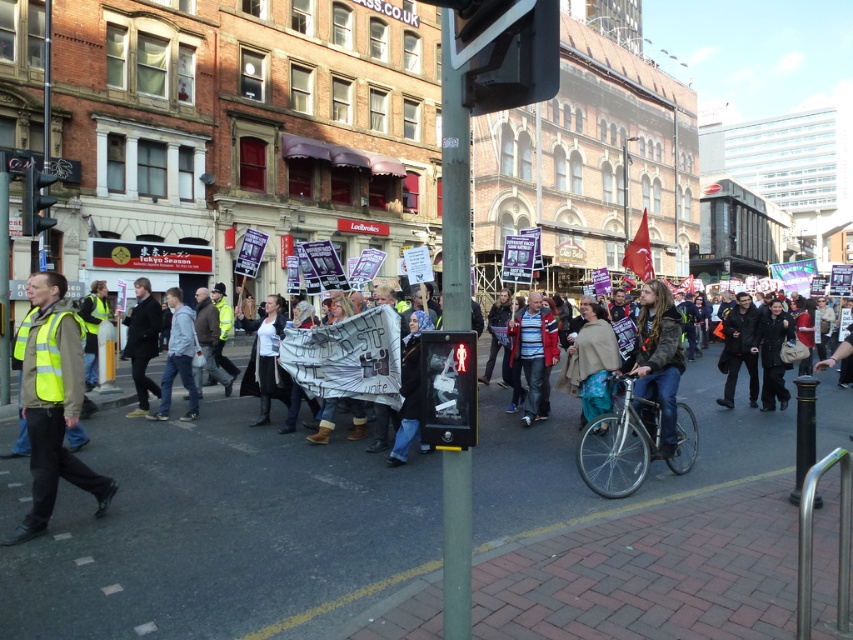
Does brick pavement at lower center appear on the right side of light gray fabric jacket at center?

Yes, brick pavement at lower center is to the right of light gray fabric jacket at center.

Is brick pavement at lower center wider than light gray fabric jacket at center?

Correct, the width of brick pavement at lower center exceeds that of light gray fabric jacket at center.

Image resolution: width=853 pixels, height=640 pixels. I want to click on brick pavement at lower center, so click(x=222, y=534).

Does point (531, 378) come farther from viewer compared to point (141, 328)?

Yes, point (531, 378) is behind point (141, 328).

Based on the photo, which of these two, striped cotton shirt at center or dark gray jacket at center, stands taller?

Standing taller between the two is striped cotton shirt at center.

Between point (527, 307) and point (148, 412), which one is positioned in front?

Point (527, 307)

You are a GUI agent. You are given a task and a screenshot of the screen. Output one action in this format:
    pyautogui.click(x=<x>, y=<y>)
    Task: Click on the striped cotton shirt at center
    
    Given the screenshot: What is the action you would take?
    pyautogui.click(x=532, y=352)

Does striped cotton shirt at center have a larger size compared to beige woolen cape at center?

Yes.

Is striped cotton shirt at center to the right of beige woolen cape at center from the viewer's perspective?

In fact, striped cotton shirt at center is to the left of beige woolen cape at center.

The width and height of the screenshot is (853, 640). What do you see at coordinates (532, 352) in the screenshot?
I see `striped cotton shirt at center` at bounding box center [532, 352].

The image size is (853, 640). In order to click on striped cotton shirt at center in this screenshot , I will do `click(532, 352)`.